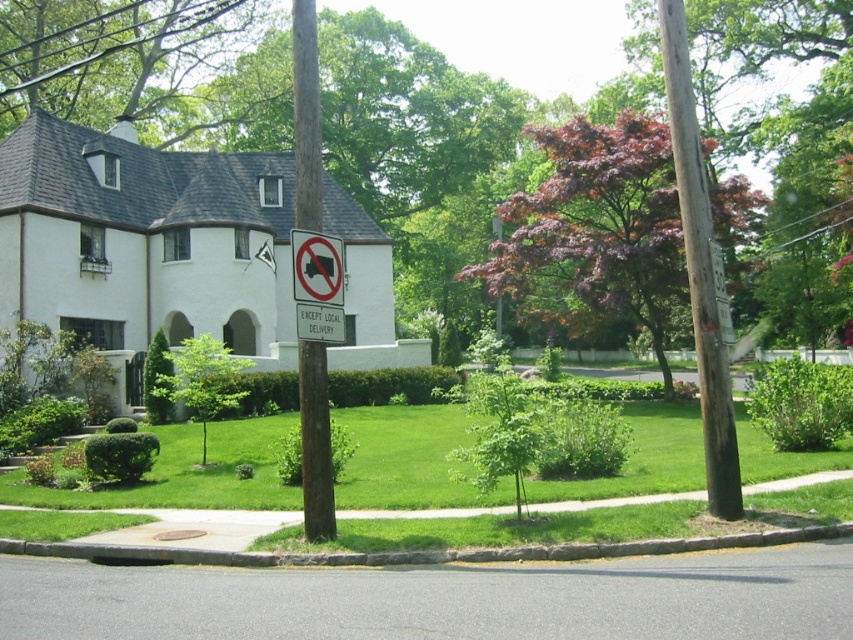
This screenshot has width=853, height=640. Describe the element at coordinates (598, 227) in the screenshot. I see `purple glossy tree at center` at that location.

Which is in front, point (550, 216) or point (312, 266)?

Positioned in front is point (312, 266).

Is point (592, 218) less distant than point (339, 289)?

No, it is not.

You are a GUI agent. You are given a task and a screenshot of the screen. Output one action in this format:
    pyautogui.click(x=<x>, y=<y>)
    Task: Click on the purple glossy tree at center
    The height and width of the screenshot is (640, 853).
    Given the screenshot: What is the action you would take?
    pyautogui.click(x=598, y=227)

Does purple glossy tree at center have a greater height compared to brown wooden telegraph pole at right?

Correct, purple glossy tree at center is much taller as brown wooden telegraph pole at right.

Can you confirm if purple glossy tree at center is positioned below brown wooden telegraph pole at right?

No, purple glossy tree at center is not below brown wooden telegraph pole at right.

This screenshot has width=853, height=640. I want to click on purple glossy tree at center, so click(x=598, y=227).

Locate an element on the screen. This screenshot has height=640, width=853. purple glossy tree at center is located at coordinates (598, 227).

Is matte black truck at center in front of white plastic sign at center?

No.

Which of these two, matte black truck at center or white plastic sign at center, stands taller?

matte black truck at center is taller.

The height and width of the screenshot is (640, 853). What do you see at coordinates (317, 268) in the screenshot?
I see `matte black truck at center` at bounding box center [317, 268].

Locate an element on the screen. matte black truck at center is located at coordinates (317, 268).